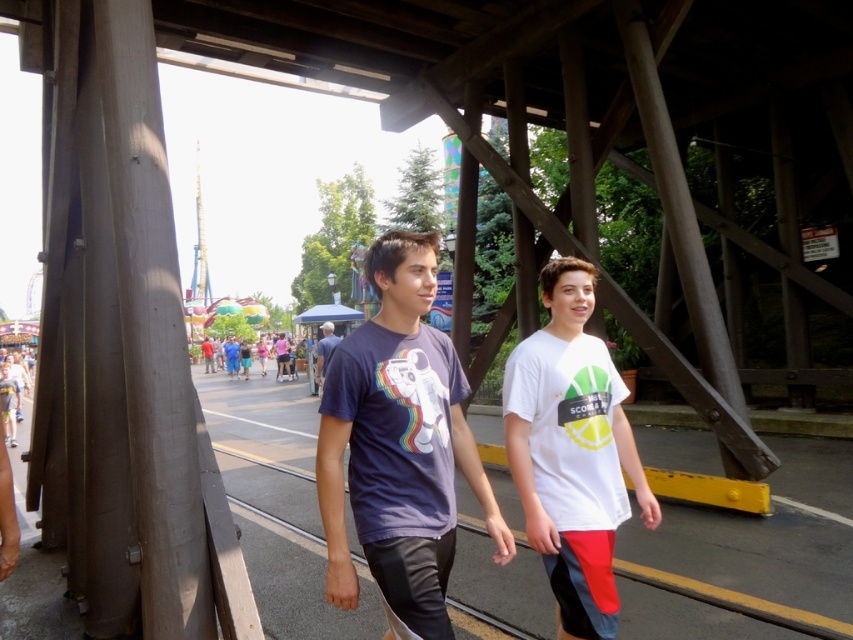
Is white matte t-shirt at center above matte purple shirt at center?

Yes.

Can you confirm if white matte t-shirt at center is positioned to the left of matte purple shirt at center?

No, white matte t-shirt at center is not to the left of matte purple shirt at center.

Is point (621, 509) closer to viewer compared to point (242, 356)?

That is True.

Locate an element on the screen. The image size is (853, 640). white matte t-shirt at center is located at coordinates (572, 452).

Which is behind, point (230, 368) or point (332, 333)?

Point (230, 368)

Which is below, matte purple shirt at center or blue denim jeans at center?

matte purple shirt at center is below.

Who is more forward, (287,355) or (323,355)?

Point (323,355) is in front.

Identify the location of matte purple shirt at center. The width and height of the screenshot is (853, 640). (235, 356).

Based on the photo, does matte purple t-shirt at center lie in front of matte purple shirt at center?

That is True.

Can you confirm if matte purple t-shirt at center is positioned to the left of matte purple shirt at center?

In fact, matte purple t-shirt at center is to the right of matte purple shirt at center.

Between point (450, 483) and point (227, 368), which one is positioned in front?

Point (450, 483)

Find the location of a particular element. This screenshot has height=640, width=853. matte purple t-shirt at center is located at coordinates (399, 448).